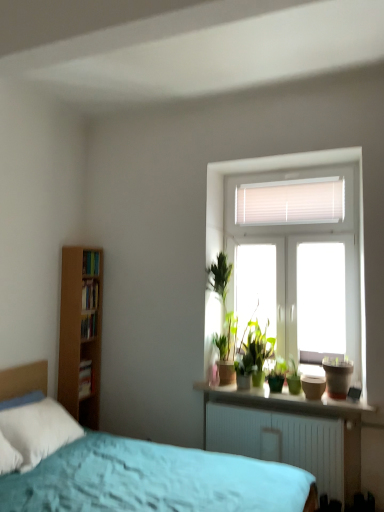
Identify the location of vacant area situated below matte brown flowerpot at right (from a real-world perspective). (342, 397).